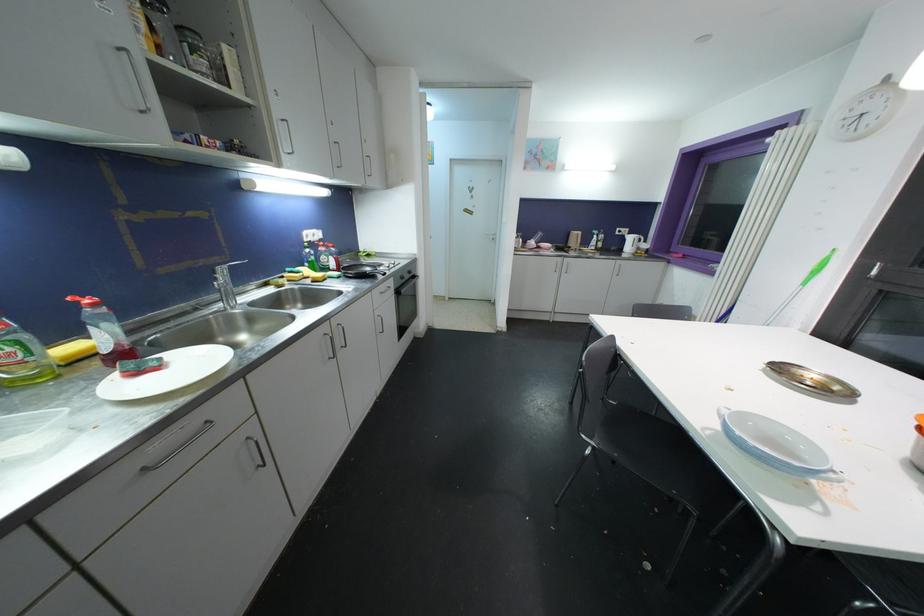
The height and width of the screenshot is (616, 924). What are the coordinates of `metal drawer handle` in the screenshot? It's located at (178, 448).